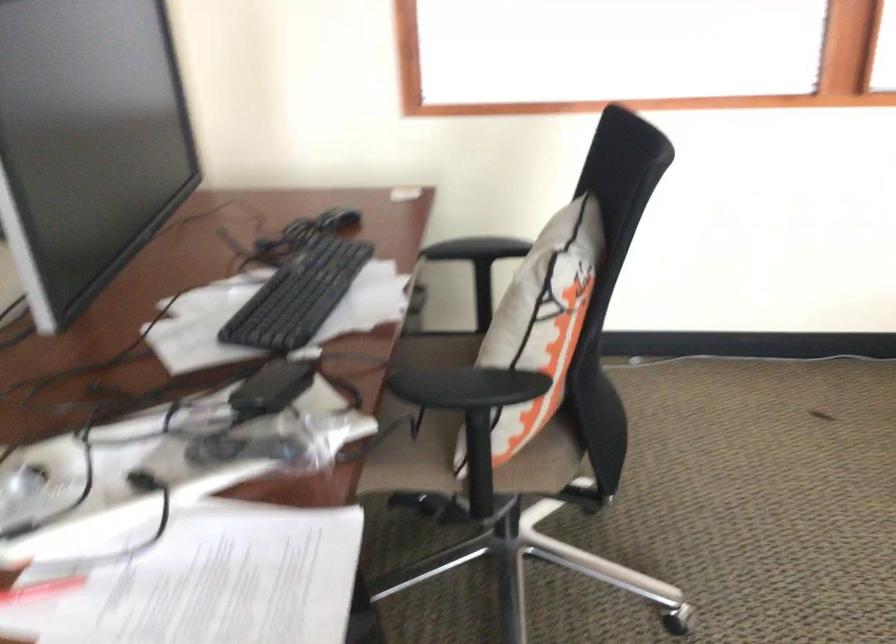
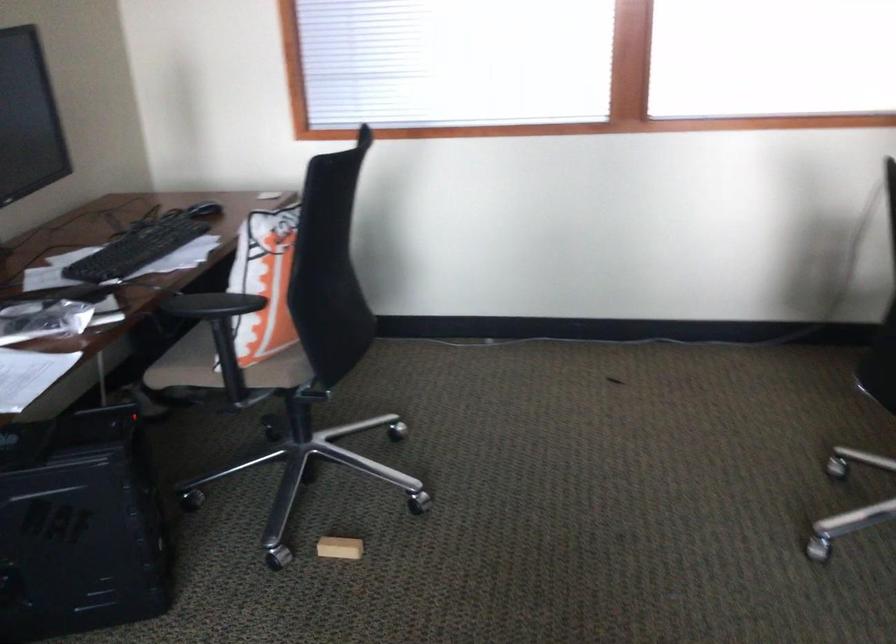
Locate, in the second image, the point that corresponds to [305,292] in the first image.

(138, 248)